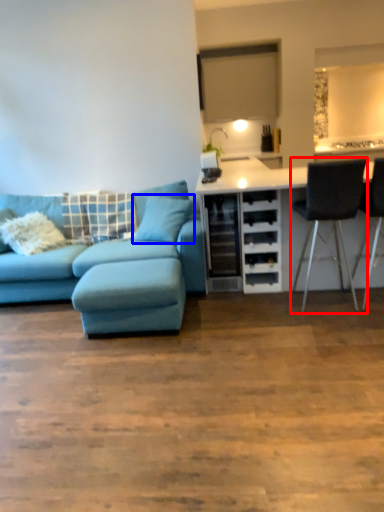
Question: Which object appears closest to the camera in this image, chair (highlighted by a red box) or pillow (highlighted by a blue box)?

Choices:
 (A) chair
 (B) pillow

Answer: (A)